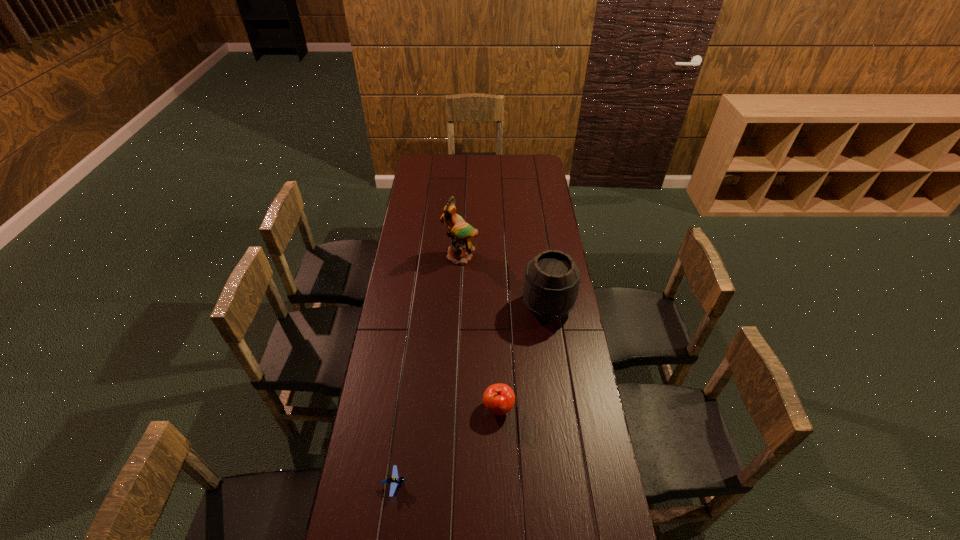
Where is `vacant area that lies between the farthest object and the Lego`? This screenshot has height=540, width=960. vacant area that lies between the farthest object and the Lego is located at coordinates (427, 370).

Where is `free space between the wine bucket and the nearest object`? The image size is (960, 540). free space between the wine bucket and the nearest object is located at coordinates (471, 396).

At what (x,y) coordinates should I click in order to perform the action: click on unoccupied area between the third nearest object and the parrot. Please return your answer as a coordinate pair (x, y). The width and height of the screenshot is (960, 540). Looking at the image, I should click on [x=504, y=282].

Where is `free spot between the farthest object and the second shortest object`? This screenshot has height=540, width=960. free spot between the farthest object and the second shortest object is located at coordinates (479, 332).

Identify the location of empty space that is in between the apple and the tallest object. The height and width of the screenshot is (540, 960). (479, 332).

Identify the location of free space between the nearest object and the third nearest object. (471, 396).

Locate which object is the third closest to the second shortest object. Please provide its 2D coordinates. Your answer should be formatted as a tuple, i.e. [(x, y)], where the tuple contains the x and y coordinates of a point satisfying the conditions above.

[(459, 252)]

Locate an element on the screen. object that is the second nearest to the third object from left to right is located at coordinates (551, 284).

Locate an element on the screen. free spot that satisfies the following two spatial constraints: 1. on the front-facing side of the third object from right to left; 2. on the front-facing side of the nearest object is located at coordinates (449, 484).

Where is `free space that satisfies the following two spatial constraints: 1. on the front-facing side of the wine bucket; 2. on the left side of the farthest object`? The image size is (960, 540). free space that satisfies the following two spatial constraints: 1. on the front-facing side of the wine bucket; 2. on the left side of the farthest object is located at coordinates (458, 307).